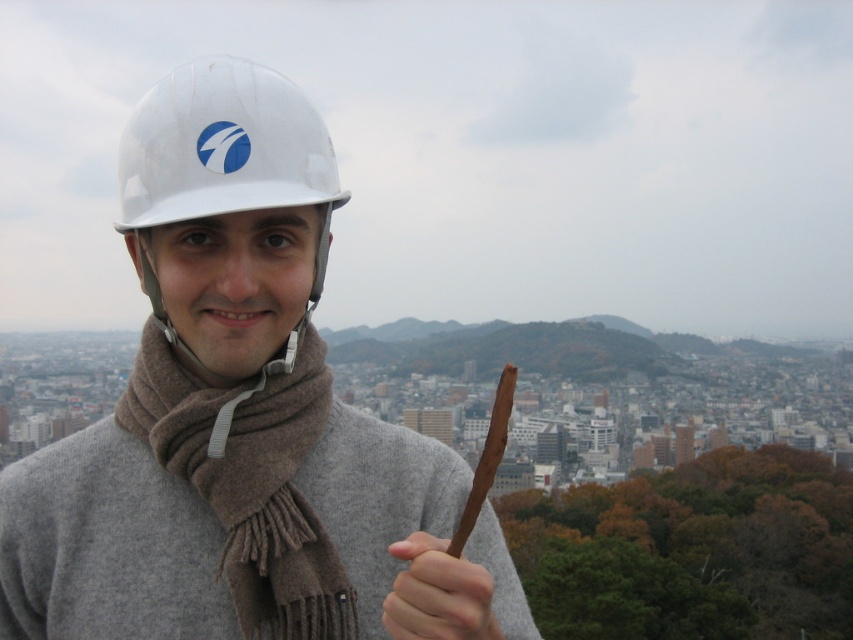
Does gray wool scarf at center have a greater width compared to smooth brown stick at center?

Indeed, gray wool scarf at center has a greater width compared to smooth brown stick at center.

Who is positioned more to the left, gray wool scarf at center or smooth brown stick at center?

From the viewer's perspective, gray wool scarf at center appears more on the left side.

Is point (360, 561) behind point (460, 621)?

Yes, point (360, 561) is behind point (460, 621).

This screenshot has height=640, width=853. What are the coordinates of `gray wool scarf at center` in the screenshot? It's located at (107, 547).

Does brown woolen scarf at center have a lesser height compared to smooth brown stick at center?

In fact, brown woolen scarf at center may be taller than smooth brown stick at center.

Which is in front, point (189, 410) or point (482, 605)?

Point (482, 605) is in front.

Where is `brown woolen scarf at center`? The height and width of the screenshot is (640, 853). brown woolen scarf at center is located at coordinates (250, 480).

Who is more forward, (38,582) or (177,68)?

Positioned in front is point (38,582).

Image resolution: width=853 pixels, height=640 pixels. Describe the element at coordinates (107, 547) in the screenshot. I see `gray wool scarf at center` at that location.

Is point (3, 552) in front of point (137, 196)?

Yes, point (3, 552) is in front of point (137, 196).

At what (x,y) coordinates should I click in order to perform the action: click on gray wool scarf at center. Please return your answer as a coordinate pair (x, y). Image resolution: width=853 pixels, height=640 pixels. Looking at the image, I should click on (107, 547).